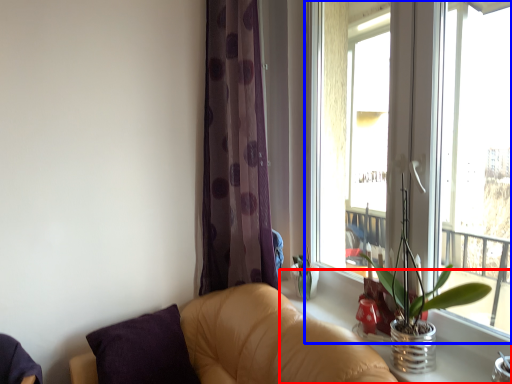
Question: Which object appears farthest to the camera in this image, window sill (highlighted by a red box) or window (highlighted by a blue box)?

Choices:
 (A) window sill
 (B) window

Answer: (A)